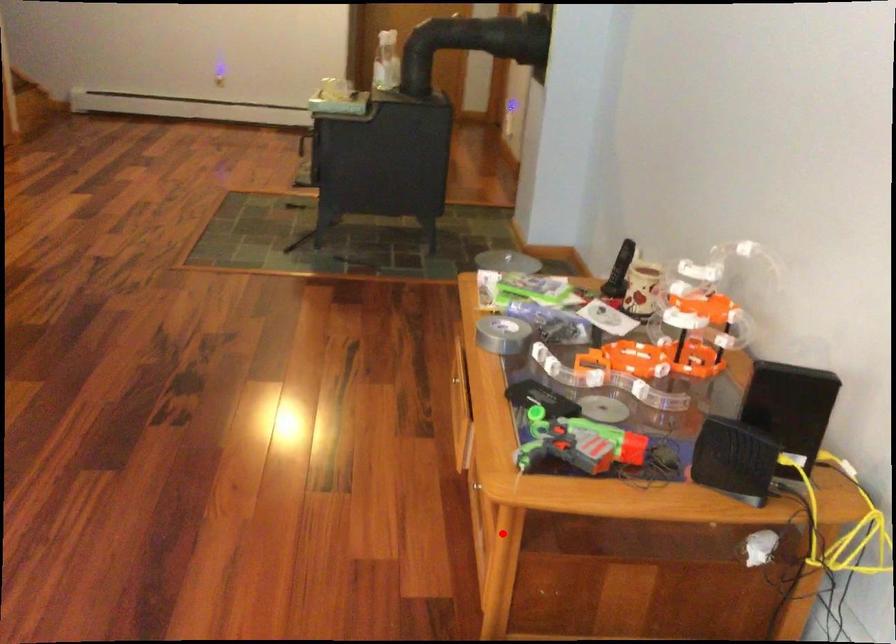
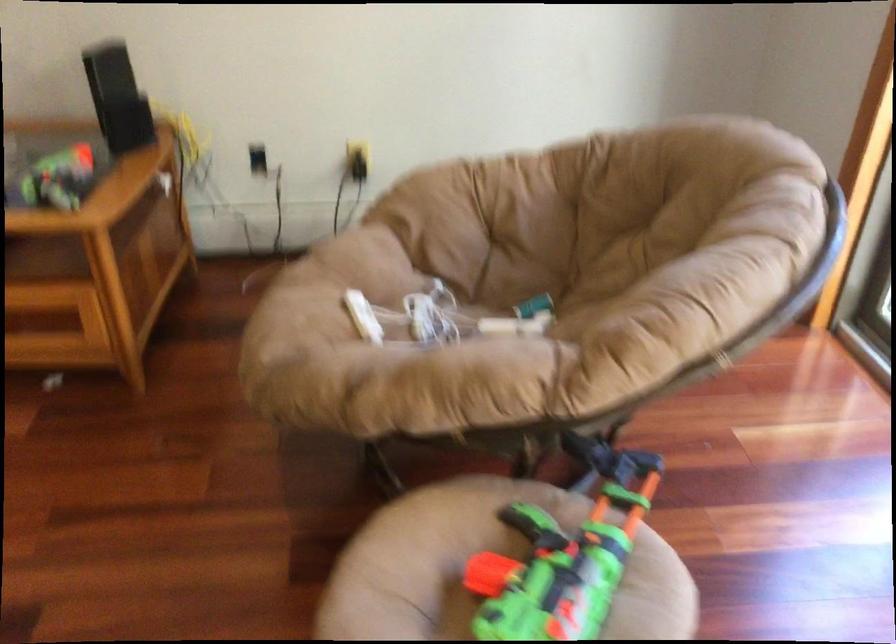
Locate, in the second image, the point that corresponds to the highlighted location in the first image.

(95, 263)